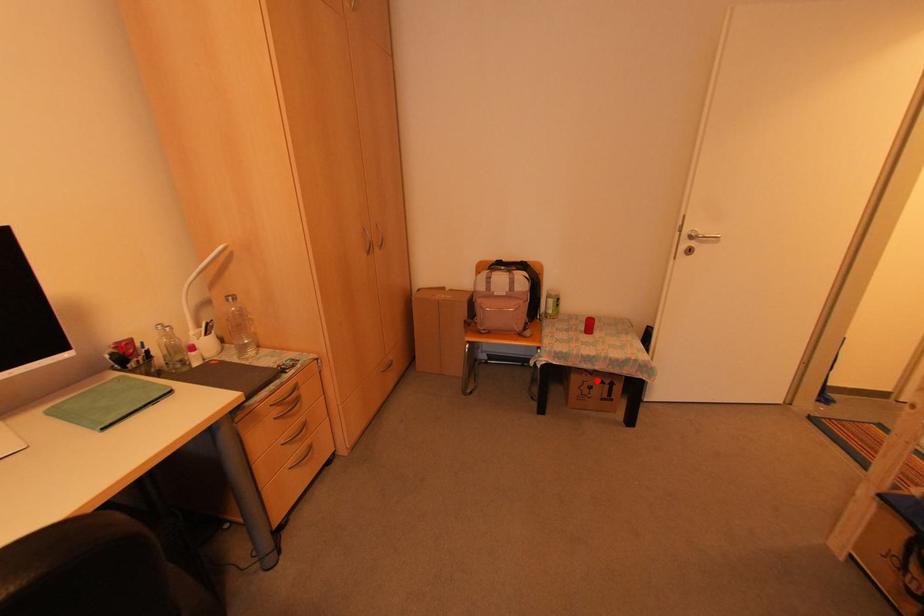
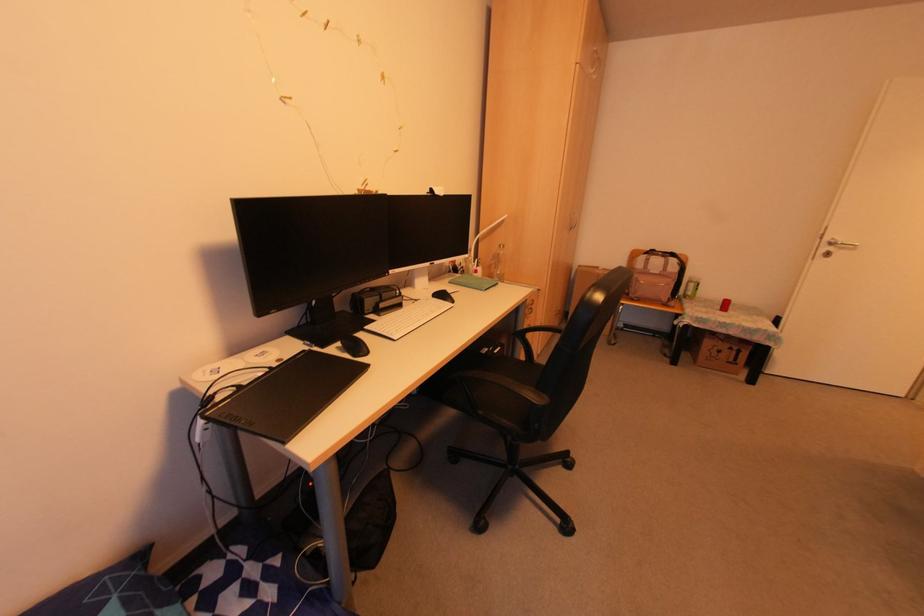
Question: I am providing you with two images of the same scene from different viewpoints. In image1, a red point is highlighted. Considering the same 3D point in image2, which of the following is correct?

Choices:
 (A) It is closer
 (B) It is farther

Answer: (A)